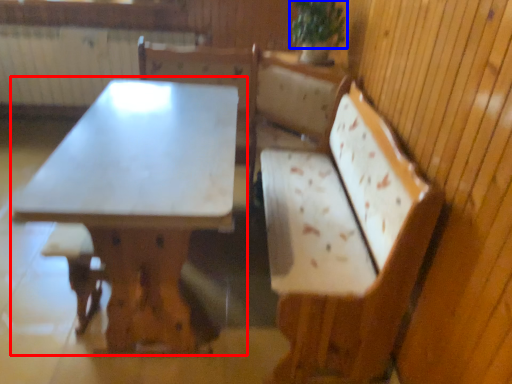
Question: Which object appears farthest to the camera in this image, table (highlighted by a red box) or plant (highlighted by a blue box)?

Choices:
 (A) table
 (B) plant

Answer: (B)